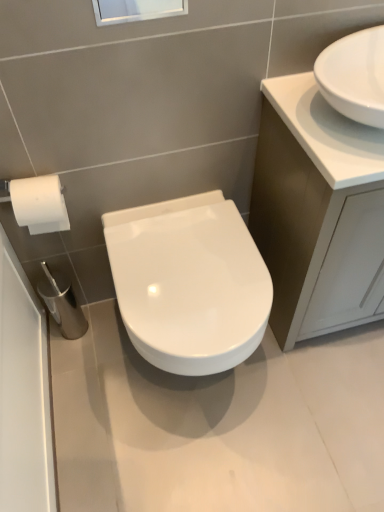
Question: Considering the relative sizes of transparent glass window screen at upper center and white glossy toilet at center in the image provided, is transparent glass window screen at upper center bigger than white glossy toilet at center?

Choices:
 (A) no
 (B) yes

Answer: (A)

Question: From the image's perspective, is transparent glass window screen at upper center located above white glossy toilet at center?

Choices:
 (A) yes
 (B) no

Answer: (A)

Question: Is transparent glass window screen at upper center next to white glossy toilet at center and touching it?

Choices:
 (A) yes
 (B) no

Answer: (B)

Question: Considering the relative positions of transparent glass window screen at upper center and white glossy toilet at center in the image provided, is transparent glass window screen at upper center to the right of white glossy toilet at center from the viewer's perspective?

Choices:
 (A) no
 (B) yes

Answer: (A)

Question: Would you say white glossy toilet at center is part of transparent glass window screen at upper center's contents?

Choices:
 (A) yes
 (B) no

Answer: (B)

Question: Is transparent glass window screen at upper center at the left side of white glossy toilet at center?

Choices:
 (A) yes
 (B) no

Answer: (A)

Question: Considering the relative sizes of white glossy toilet at center and transparent glass window screen at upper center in the image provided, is white glossy toilet at center bigger than transparent glass window screen at upper center?

Choices:
 (A) no
 (B) yes

Answer: (B)

Question: Is white glossy toilet at center thinner than transparent glass window screen at upper center?

Choices:
 (A) no
 (B) yes

Answer: (A)

Question: Is white glossy toilet at center outside of transparent glass window screen at upper center?

Choices:
 (A) yes
 (B) no

Answer: (A)

Question: Is white glossy toilet at center beside transparent glass window screen at upper center?

Choices:
 (A) no
 (B) yes

Answer: (A)

Question: From a real-world perspective, is white glossy toilet at center below transparent glass window screen at upper center?

Choices:
 (A) yes
 (B) no

Answer: (A)

Question: Does white glossy toilet at center have a smaller size compared to transparent glass window screen at upper center?

Choices:
 (A) no
 (B) yes

Answer: (A)

Question: From a real-world perspective, is transparent glass window screen at upper center located beneath white glossy sink at upper right?

Choices:
 (A) yes
 (B) no

Answer: (B)